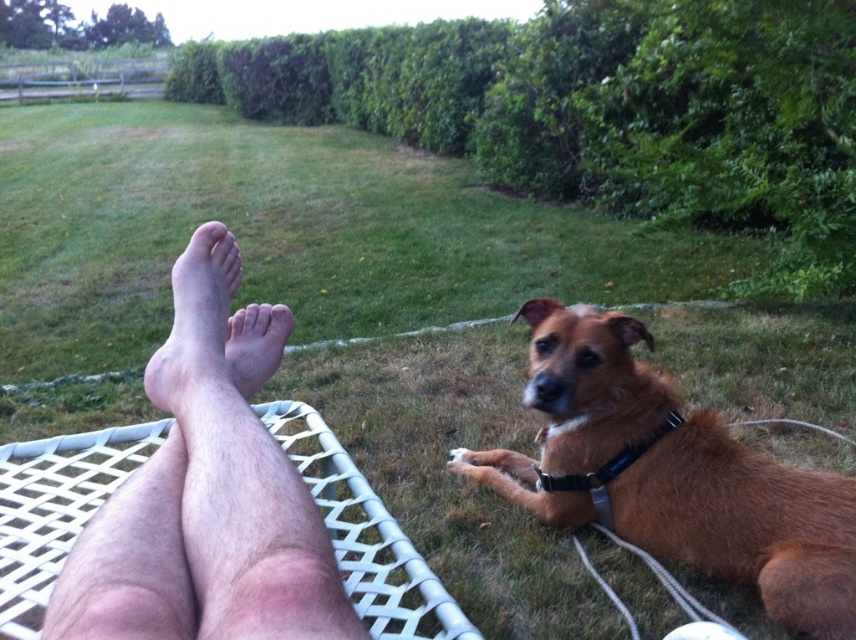
Between hair-covered skin at center and smooth skin foot at center, which one is positioned higher?

smooth skin foot at center is higher up.

Is hair-covered skin at center bigger than smooth skin foot at center?

Yes, hair-covered skin at center is bigger than smooth skin foot at center.

Between point (257, 529) and point (253, 321), which one is positioned behind?

Point (253, 321)

What are the coordinates of `hair-covered skin at center` in the screenshot? It's located at (207, 492).

Is pale skin at center shorter than smooth skin foot at center?

In fact, pale skin at center may be taller than smooth skin foot at center.

Who is more distant from viewer, (174, 401) or (242, 385)?

Positioned behind is point (242, 385).

This screenshot has height=640, width=856. Find the location of `pale skin at center`. pale skin at center is located at coordinates (197, 326).

Image resolution: width=856 pixels, height=640 pixels. Describe the element at coordinates (670, 474) in the screenshot. I see `brown furry dog at lower right` at that location.

In the scene shown: Is brown furry dog at lower right bigger than pale skin at center?

Indeed, brown furry dog at lower right has a larger size compared to pale skin at center.

Measure the distance between point (574, 362) and camera.

They are 5.67 feet apart.

Locate an element on the screen. brown furry dog at lower right is located at coordinates (670, 474).